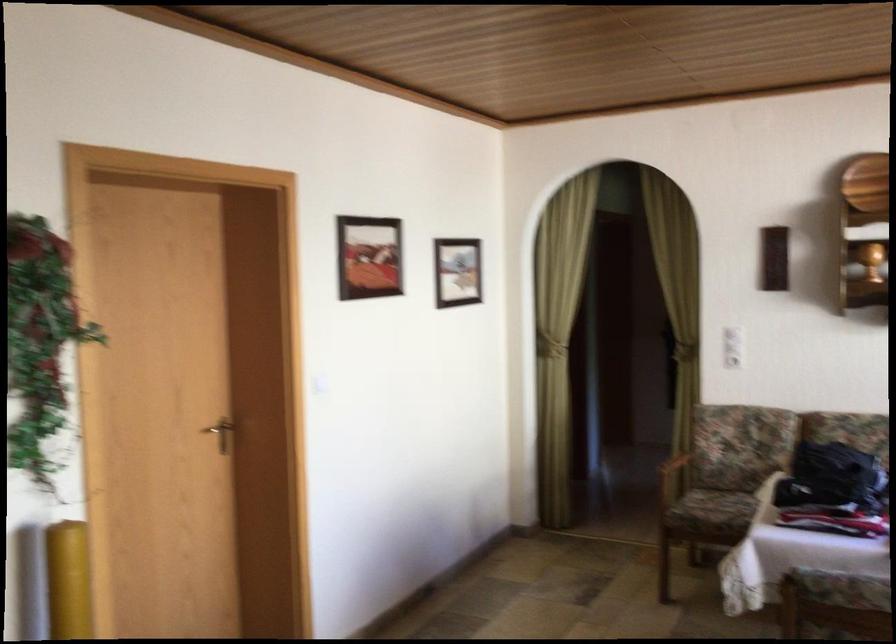
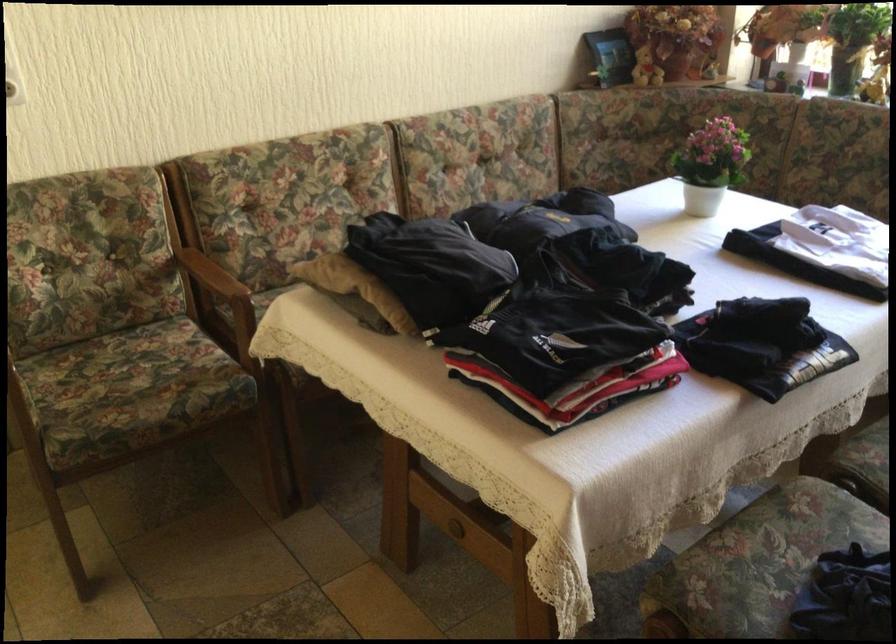
Where in the second image is the point corresponding to (721,504) from the first image?

(130, 383)